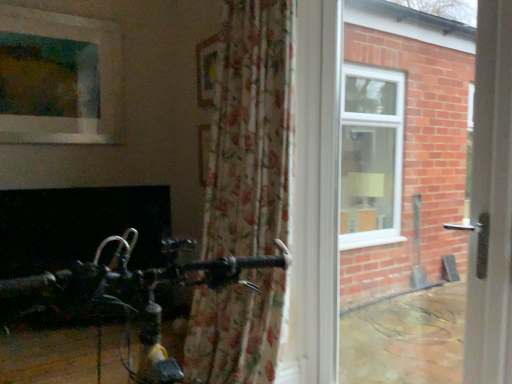
Describe the element at coordinates (250, 132) in the screenshot. The height and width of the screenshot is (384, 512). I see `floral fabric curtain at center` at that location.

The width and height of the screenshot is (512, 384). I want to click on matte glass window at upper left, so point(58,78).

Looking at this image, in order to face transparent plastic screen door at right, should I rotate leftwards or rightwards?

To face it directly, rotate right by 31.310 degrees.

You are a GUI agent. You are given a task and a screenshot of the screen. Output one action in this format:
    pyautogui.click(x=<x>, y=<y>)
    Task: Click on the wooden frame at upper center
    Image resolution: width=512 pixels, height=384 pixels.
    Given the screenshot: What is the action you would take?
    pos(207,69)

How distant is transparent plastic screen door at right from matte glass window at upper left?

A distance of 6.95 feet exists between transparent plastic screen door at right and matte glass window at upper left.

In terms of width, does transparent plastic screen door at right look wider or thinner when compared to matte glass window at upper left?

transparent plastic screen door at right is wider than matte glass window at upper left.

Visually, is transparent plastic screen door at right positioned to the left or to the right of matte glass window at upper left?

transparent plastic screen door at right is positioned on matte glass window at upper left's right side.

Looking at this image, is transparent plastic screen door at right in contact with matte glass window at upper left?

transparent plastic screen door at right and matte glass window at upper left are clearly separated.

Is white plastic door handle at right a part of matte glass window at upper left?

No, white plastic door handle at right is not a part of matte glass window at upper left.

Considering the relative positions of matte glass window at upper left and white plastic door handle at right in the image provided, is matte glass window at upper left to the left or to the right of white plastic door handle at right?

Clearly, matte glass window at upper left is on the left of white plastic door handle at right in the image.

Identify the location of window frame located below the matte glass window at upper left (from the image's perspective). (404, 193).

Is the surface of matte glass window at upper left in direct contact with white plastic door handle at right?

matte glass window at upper left and white plastic door handle at right are not in contact.

What's the angular difference between white plastic door handle at right and floral fabric curtain at center's facing directions?

The facing directions of white plastic door handle at right and floral fabric curtain at center are 0.343 degrees apart.

From a real-world perspective, who is located lower, white plastic door handle at right or floral fabric curtain at center?

white plastic door handle at right, from a real-world perspective.

Considering the relative sizes of white plastic door handle at right and floral fabric curtain at center in the image provided, is white plastic door handle at right thinner than floral fabric curtain at center?

Yes.

Between white plastic door handle at right and floral fabric curtain at center, which one has smaller size?

white plastic door handle at right.

Based on the photo, is wooden frame at upper center far away from matte glass window at upper left?

Actually, wooden frame at upper center and matte glass window at upper left are a little close together.

In the image, there is a wooden frame at upper center. Where is `window below it (from a real-world perspective)`? The image size is (512, 384). window below it (from a real-world perspective) is located at coordinates (58, 78).

Is point (199, 90) positioned behind point (45, 36)?

Yes, point (199, 90) is farther from viewer.

Considering the positions of objects wooden frame at upper center and matte glass window at upper left in the image provided, who is behind, wooden frame at upper center or matte glass window at upper left?

matte glass window at upper left is further from the camera.

Is matte glass window at upper left facing away from transparent plastic screen door at right?

No, matte glass window at upper left is not facing away from transparent plastic screen door at right.

Consider the image. From the image's perspective, is matte glass window at upper left positioned above or below transparent plastic screen door at right?

From the image's perspective, matte glass window at upper left appears above transparent plastic screen door at right.

Measure the distance from matte glass window at upper left to transparent plastic screen door at right.

A distance of 6.95 feet exists between matte glass window at upper left and transparent plastic screen door at right.

In terms of height, does matte glass window at upper left look taller or shorter compared to transparent plastic screen door at right?

matte glass window at upper left is shorter than transparent plastic screen door at right.

Does transparent plastic screen door at right turn towards white plastic door handle at right?

No, transparent plastic screen door at right is not aimed at white plastic door handle at right.

Is transparent plastic screen door at right at the left side of white plastic door handle at right?

No, transparent plastic screen door at right is not to the left of white plastic door handle at right.

In the scene shown: Is transparent plastic screen door at right wider or thinner than white plastic door handle at right?

transparent plastic screen door at right is wider than white plastic door handle at right.

This screenshot has width=512, height=384. In order to click on screen door lying above the white plastic door handle at right (from the image's perspective) in this screenshot , I will do `click(490, 203)`.

In terms of height, does floral fabric curtain at center look taller or shorter compared to white plastic door handle at right?

In the image, floral fabric curtain at center appears to be shorter than white plastic door handle at right.

Is floral fabric curtain at center not near white plastic door handle at right?

Absolutely, floral fabric curtain at center is distant from white plastic door handle at right.

Looking at this image, can you confirm if floral fabric curtain at center is bigger than white plastic door handle at right?

Indeed, floral fabric curtain at center has a larger size compared to white plastic door handle at right.

Where is `screen door in front of the matte glass window at upper left`? This screenshot has width=512, height=384. screen door in front of the matte glass window at upper left is located at coordinates [490, 203].

In the image, there is a matte glass window at upper left. Where is `window frame below it (from the image's perspective)`? The image size is (512, 384). window frame below it (from the image's perspective) is located at coordinates (404, 193).

From the image, which object appears to be farther from matte glass window at upper left, white plastic door handle at right or transparent plastic screen door at right?

Based on the image, transparent plastic screen door at right appears to be further to matte glass window at upper left.

Based on the photo, from the image, which object appears to be farther from transparent plastic screen door at right, matte glass window at upper left or white plastic door handle at right?

matte glass window at upper left is positioned further to the anchor transparent plastic screen door at right.

When comparing their distances from transparent plastic screen door at right, does matte glass window at upper left or wooden frame at upper center seem further?

The object further to transparent plastic screen door at right is matte glass window at upper left.

Which object lies further to the anchor point transparent plastic screen door at right, white plastic door handle at right or floral fabric curtain at center?

white plastic door handle at right lies further to transparent plastic screen door at right than the other object.

When comparing their distances from floral fabric curtain at center, does matte glass window at upper left or white plastic door handle at right seem further?

white plastic door handle at right lies further to floral fabric curtain at center than the other object.

When comparing their distances from white plastic door handle at right, does transparent plastic screen door at right or floral fabric curtain at center seem closer?

floral fabric curtain at center.

Which object lies further to the anchor point transparent plastic screen door at right, floral fabric curtain at center or matte glass window at upper left?

matte glass window at upper left lies further to transparent plastic screen door at right than the other object.

Considering their positions, is white plastic door handle at right positioned further to wooden frame at upper center than matte glass window at upper left?

Among the two, white plastic door handle at right is located further to wooden frame at upper center.

Identify the location of window frame located between matte glass window at upper left and transparent plastic screen door at right in the left-right direction. The width and height of the screenshot is (512, 384). (404, 193).

At what (x,y) coordinates should I click in order to perform the action: click on curtain between matte glass window at upper left and white plastic door handle at right from left to right. Please return your answer as a coordinate pair (x, y). Looking at the image, I should click on (250, 132).

You are a GUI agent. You are given a task and a screenshot of the screen. Output one action in this format:
    pyautogui.click(x=<x>, y=<y>)
    Task: Click on the picture frame situated between matte glass window at upper left and floral fabric curtain at center from left to right
    
    Given the screenshot: What is the action you would take?
    207,69

I want to click on window frame between transparent plastic screen door at right and wooden frame at upper center along the z-axis, so click(x=404, y=193).